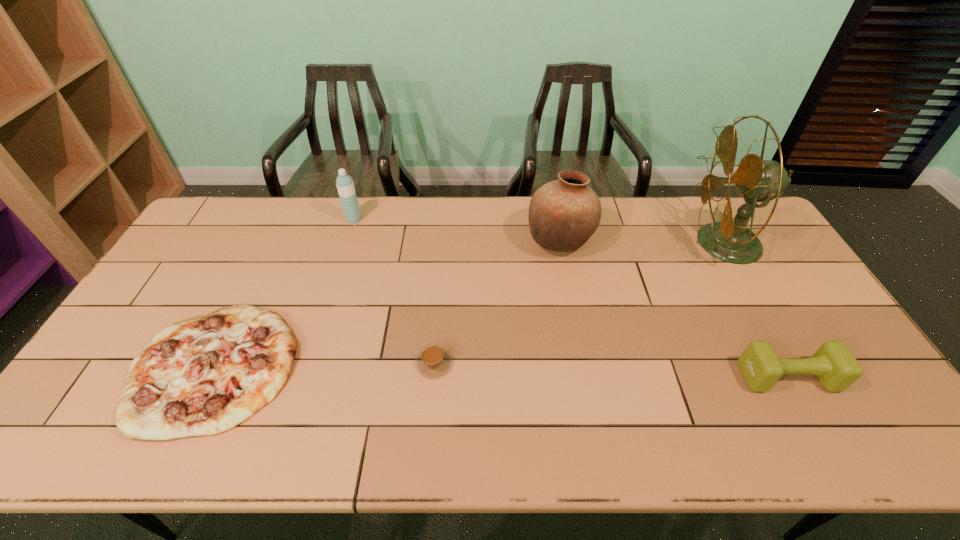
At what (x,y) coordinates should I click in order to perform the action: click on object identified as the third closest to the fourth object from right to left. Please return your answer as a coordinate pair (x, y). Looking at the image, I should click on (345, 186).

Identify the location of vacant position in the image that satisfies the following two spatial constraints: 1. in front of the fan, directing air flow; 2. on the front side of the cappuccino. The width and height of the screenshot is (960, 540). (796, 364).

Locate an element on the screen. vacant region that satisfies the following two spatial constraints: 1. on the front side of the fourth tallest object; 2. on the right side of the fifth object from right to left is located at coordinates (304, 377).

I want to click on free space that satisfies the following two spatial constraints: 1. on the back side of the cappuccino; 2. on the left side of the third object from right to left, so click(x=444, y=241).

Identify the location of vacant space that satisfies the following two spatial constraints: 1. on the back side of the leftmost object; 2. on the left side of the second object from left to right. The width and height of the screenshot is (960, 540). (285, 220).